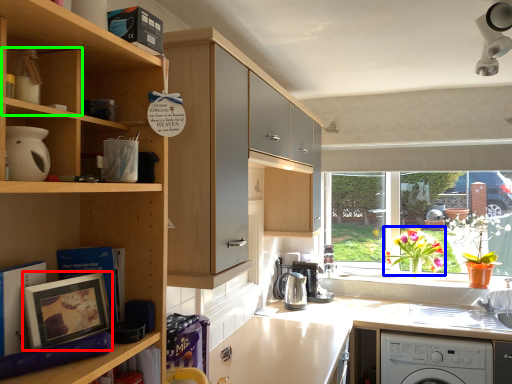
Question: Which object is the closest to the picture frame (highlighted by a red box)? Choose among these: flower (highlighted by a blue box) or cabinet (highlighted by a green box).

Choices:
 (A) flower
 (B) cabinet

Answer: (B)